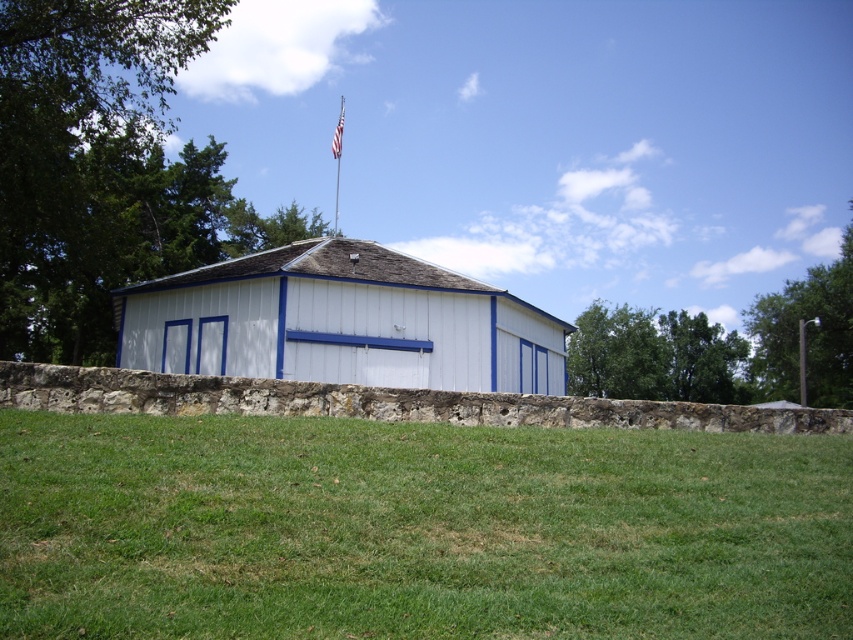
Can you confirm if green grass at lower center is smaller than white fabric flag at upper center?

Yes.

Between green grass at lower center and white fabric flag at upper center, which one is positioned higher?

white fabric flag at upper center is above.

Does point (260, 609) come closer to viewer compared to point (335, 157)?

Yes.

Find the location of `green grass at lower center`. green grass at lower center is located at coordinates (416, 529).

Is white wood shed at center closer to the viewer compared to metallic flag pole at upper center?

Yes, it is.

Between white wood shed at center and metallic flag pole at upper center, which one appears on the right side from the viewer's perspective?

From the viewer's perspective, white wood shed at center appears more on the right side.

Find the location of a particular element. This screenshot has width=853, height=640. white wood shed at center is located at coordinates (341, 321).

Does green grass at lower center lie behind white wood shed at center?

That is False.

Is point (107, 451) positioned behind point (312, 340)?

No, (107, 451) is in front of (312, 340).

Find the location of `green grass at lower center`. green grass at lower center is located at coordinates (416, 529).